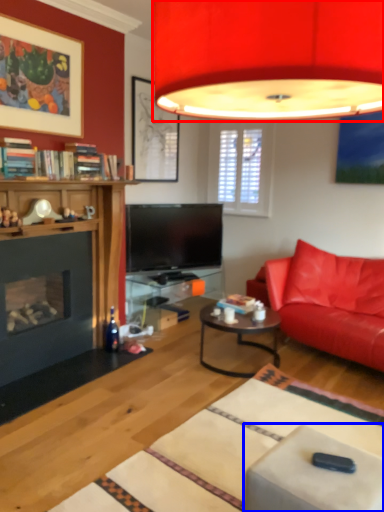
Question: Among these objects, which one is nearest to the camera, lamp (highlighted by a red box) or swivel chair (highlighted by a blue box)?

Choices:
 (A) lamp
 (B) swivel chair

Answer: (A)